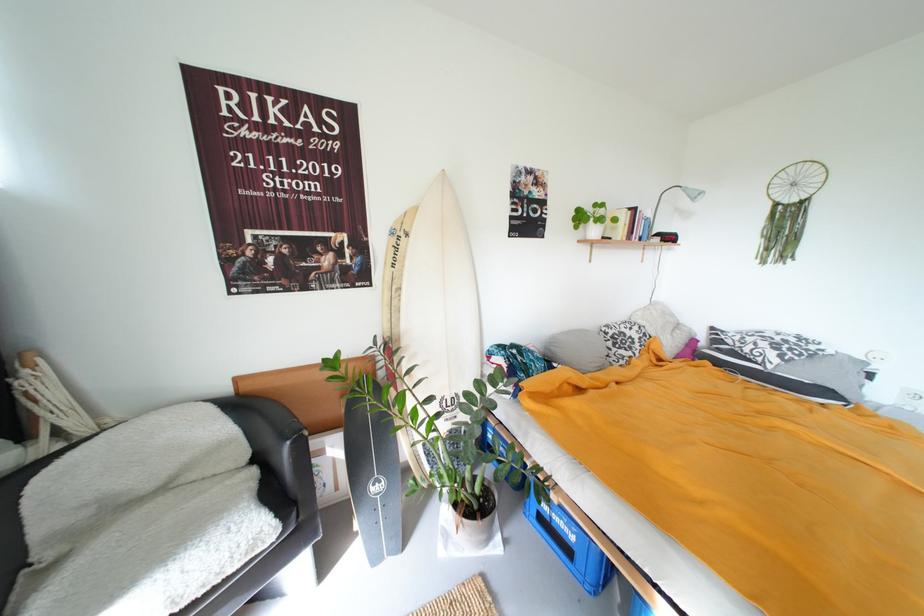
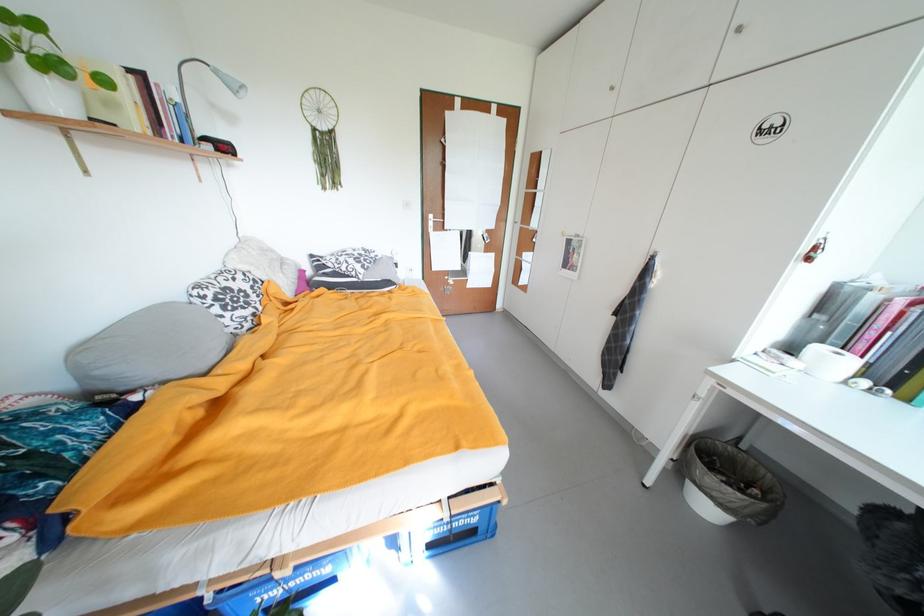
In the second image, find the point that corresponds to the point at 603,207 in the first image.

(15, 18)